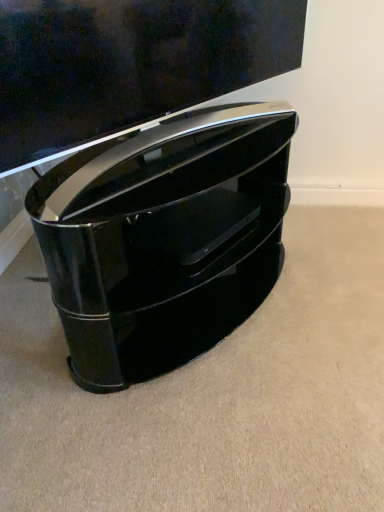
Question: Is glossy black tv stand at lower center directly adjacent to glossy black tv stand at center?

Choices:
 (A) no
 (B) yes

Answer: (A)

Question: From a real-world perspective, is glossy black tv stand at lower center over glossy black tv stand at center?

Choices:
 (A) no
 (B) yes

Answer: (B)

Question: Does glossy black tv stand at lower center contain glossy black tv stand at center?

Choices:
 (A) yes
 (B) no

Answer: (B)

Question: Is glossy black tv stand at lower center taller than glossy black tv stand at center?

Choices:
 (A) no
 (B) yes

Answer: (A)

Question: Is glossy black tv stand at lower center in front of glossy black tv stand at center?

Choices:
 (A) no
 (B) yes

Answer: (B)

Question: Considering the relative sizes of glossy black tv stand at lower center and glossy black tv stand at center in the image provided, is glossy black tv stand at lower center shorter than glossy black tv stand at center?

Choices:
 (A) yes
 (B) no

Answer: (A)

Question: Can you confirm if glossy black tv stand at center is shorter than glossy black tv stand at lower center?

Choices:
 (A) no
 (B) yes

Answer: (A)

Question: Is glossy black tv stand at center positioned with its back to glossy black tv stand at lower center?

Choices:
 (A) yes
 (B) no

Answer: (B)

Question: Considering the relative positions of glossy black tv stand at center and glossy black tv stand at lower center in the image provided, is glossy black tv stand at center to the right of glossy black tv stand at lower center from the viewer's perspective?

Choices:
 (A) yes
 (B) no

Answer: (B)

Question: Considering the relative sizes of glossy black tv stand at center and glossy black tv stand at lower center in the image provided, is glossy black tv stand at center wider than glossy black tv stand at lower center?

Choices:
 (A) yes
 (B) no

Answer: (A)

Question: Is the depth of glossy black tv stand at center greater than that of glossy black tv stand at lower center?

Choices:
 (A) yes
 (B) no

Answer: (A)

Question: From the image's perspective, would you say glossy black tv stand at center is positioned over glossy black tv stand at lower center?

Choices:
 (A) no
 (B) yes

Answer: (A)

Question: Is glossy black tv stand at center spatially inside glossy black tv stand at lower center, or outside of it?

Choices:
 (A) outside
 (B) inside

Answer: (A)